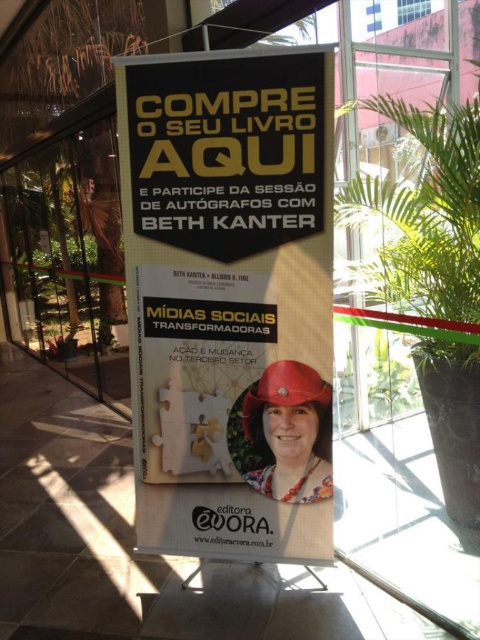
Question: Which point is farther to the camera?

Choices:
 (A) (416, 250)
 (B) (305, 388)

Answer: (A)

Question: Based on their relative distances, which object is farther from the green leafy plant at center?

Choices:
 (A) black paper poster at center
 (B) matte red helmet at center

Answer: (B)

Question: Can you confirm if black paper poster at center is positioned to the right of matte red helmet at center?

Choices:
 (A) yes
 (B) no

Answer: (B)

Question: Can you confirm if black paper poster at center is bigger than matte red helmet at center?

Choices:
 (A) no
 (B) yes

Answer: (B)

Question: Which object is positioned closest to the green leafy plant at center?

Choices:
 (A) black paper poster at center
 (B) matte red helmet at center

Answer: (A)

Question: Considering the relative positions of black paper poster at center and matte red helmet at center in the image provided, where is black paper poster at center located with respect to matte red helmet at center?

Choices:
 (A) above
 (B) below

Answer: (A)